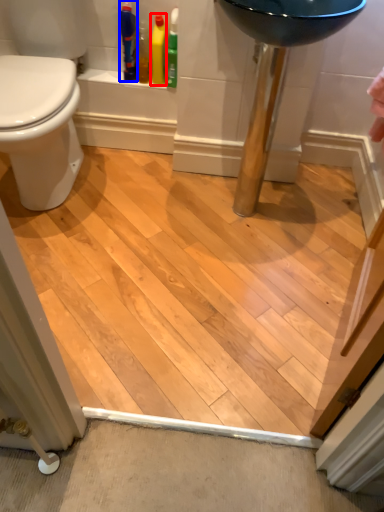
Question: Among these objects, which one is nearest to the camera, cleaning product (highlighted by a red box) or toiletry (highlighted by a blue box)?

Choices:
 (A) cleaning product
 (B) toiletry

Answer: (B)